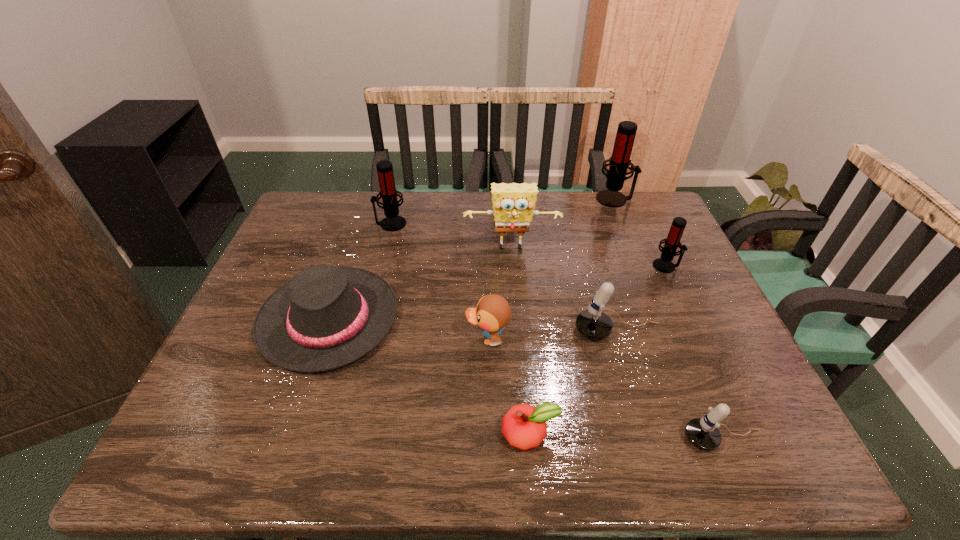
Where is `duck`? duck is located at coordinates pos(493,312).

Find the location of a particular element. This screenshot has width=960, height=540. dress hat is located at coordinates (325, 317).

Locate an element on the screen. The width and height of the screenshot is (960, 540). the nearest microphone is located at coordinates (703, 433).

I want to click on the nearer white microphone, so click(703, 433).

Find the location of a particular element. red apple is located at coordinates (524, 426).

I want to click on the shortest object, so click(x=524, y=426).

Find the location of a particular element. vacant region located on the front of the farthest red microphone is located at coordinates (631, 238).

What are the coordinates of `vacant space situated on the left of the fourth nearest microphone` in the screenshot? It's located at (303, 224).

At what (x,y) coordinates should I click in order to perform the action: click on vacant space located 0.270m on the face of the sponge. Please return your answer as a coordinate pair (x, y). The width and height of the screenshot is (960, 540). Looking at the image, I should click on (518, 329).

Find the location of a particular element. This screenshot has height=540, width=960. vacant space positioned 0.170m on the front of the second nearest microphone is located at coordinates (641, 409).